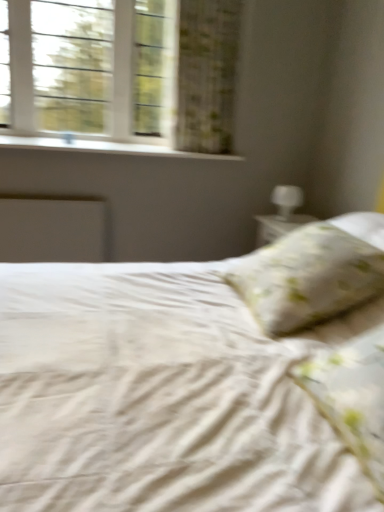
Question: From a real-world perspective, is white glass window at upper left above or below white smooth window sill at upper left?

Choices:
 (A) below
 (B) above

Answer: (B)

Question: In the image, is white glass window at upper left positioned in front of or behind white smooth window sill at upper left?

Choices:
 (A) behind
 (B) front

Answer: (A)

Question: Estimate the real-world distances between objects in this image. Which object is farther from the white floral pillow at center, the first pillow viewed from the back?

Choices:
 (A) white glossy table lamp at upper right
 (B) white glass window at upper left
 (C) green floral fabric curtain at upper left
 (D) fluffy white pillow at right, which is the second pillow in back-to-front order
 (E) white smooth window sill at upper left

Answer: (B)

Question: Which object is positioned farthest from the fluffy white pillow at right, which is the second pillow in back-to-front order?

Choices:
 (A) green floral fabric curtain at upper left
 (B) white glossy table lamp at upper right
 (C) white smooth window sill at upper left
 (D) white floral pillow at center, which ranks as the second pillow in front-to-back order
 (E) white glass window at upper left

Answer: (E)